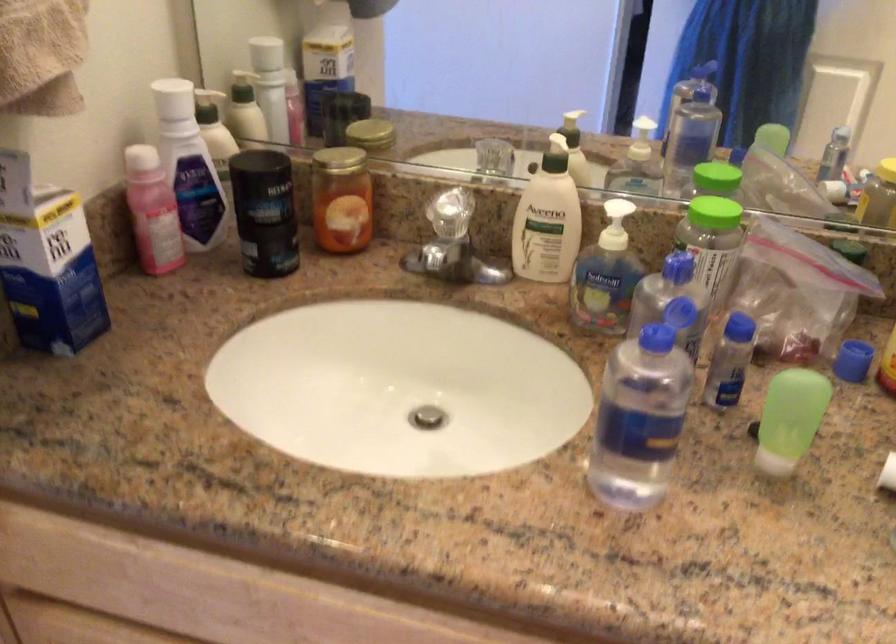
Identify the location of blue flip-top cap. The image size is (896, 644). pos(678,332).